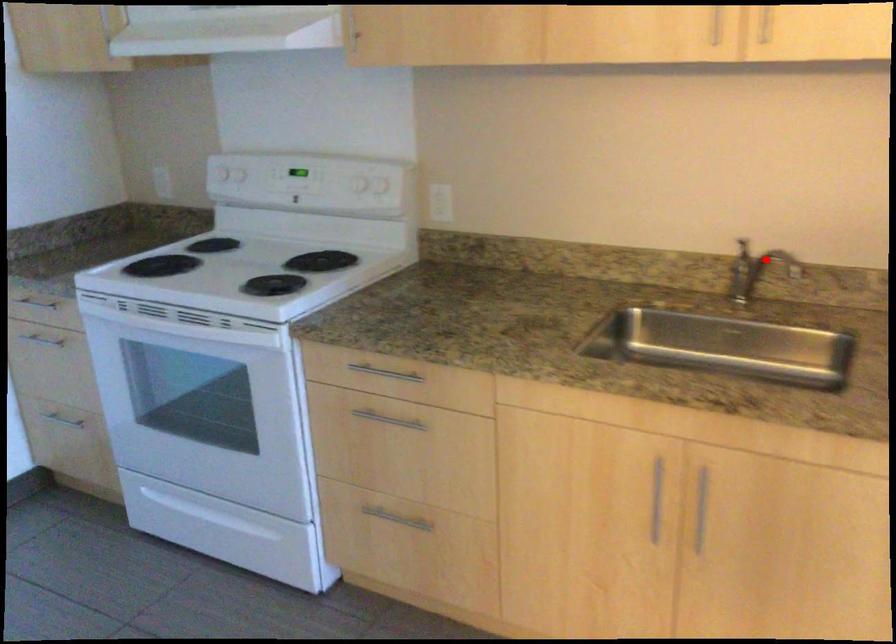
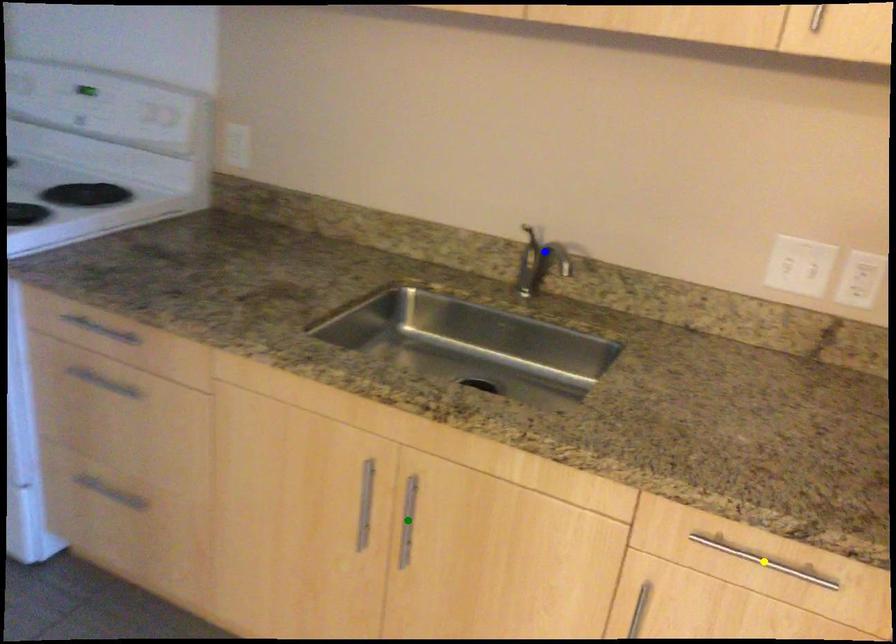
Question: I am providing you with two images of the same scene from different viewpoints. A red point is marked on the first image. You are given multiple points on the second image. Can you choose the point in image 2 that corresponds to the point in image 1?

Choices:
 (A) blue point
 (B) yellow point
 (C) green point

Answer: (A)